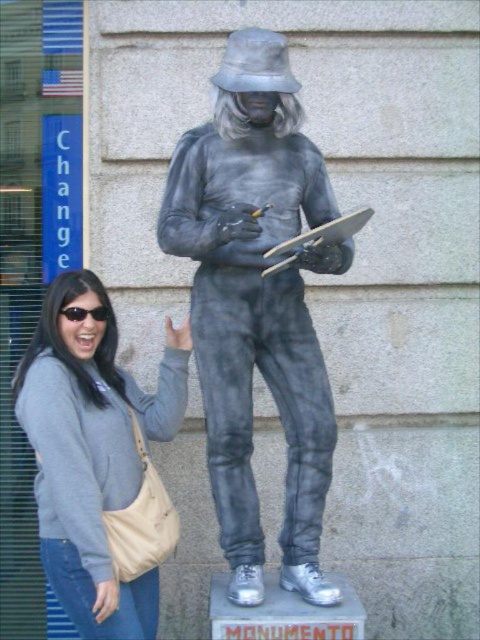
Between gray metallic figure at center and gray fabric sweatshirt at left, which one is positioned lower?

Positioned lower is gray fabric sweatshirt at left.

Who is more distant from viewer, (288, 323) or (88, 570)?

The point (288, 323) is behind.

Where is `gray metallic figure at center`? The height and width of the screenshot is (640, 480). gray metallic figure at center is located at coordinates (256, 305).